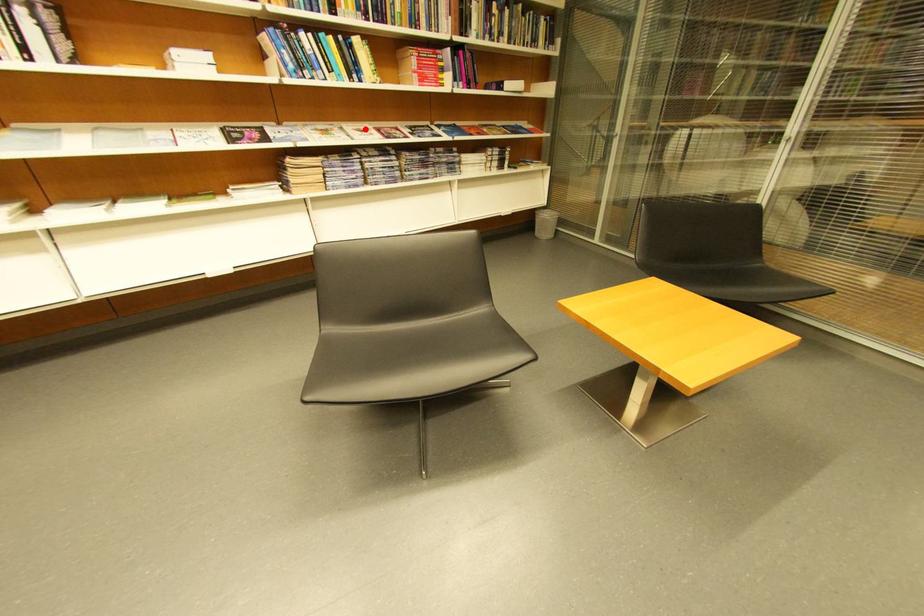
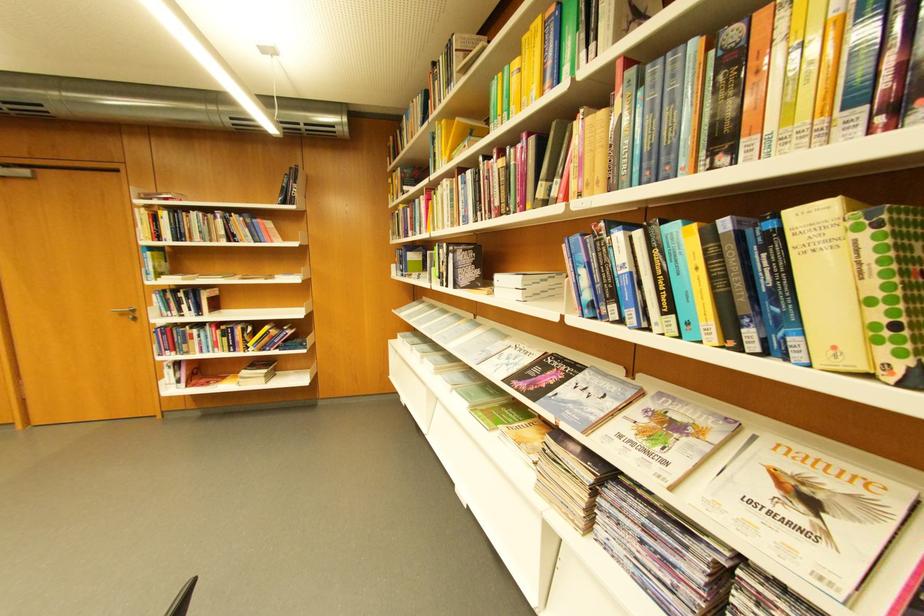
Question: A red point is marked in image1. In image2, is the corresponding 3D point closer to the camera or farther? Reply with the corresponding letter.

Choices:
 (A) The corresponding 3D point is closer.
 (B) The corresponding 3D point is farther.

Answer: (B)